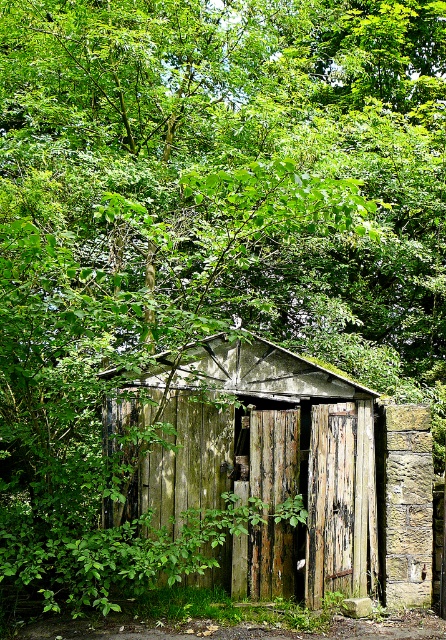
Image resolution: width=446 pixels, height=640 pixels. What do you see at coordinates (330, 500) in the screenshot? I see `peeling wood door at center` at bounding box center [330, 500].

Does peeling wood door at center appear on the right side of weathered wood door at center?

Correct, you'll find peeling wood door at center to the right of weathered wood door at center.

Who is more forward, (323, 428) or (250, 531)?

Positioned in front is point (250, 531).

I want to click on peeling wood door at center, so click(330, 500).

Can you confirm if weathered wood hut at center is smaller than peeling wood door at center?

No.

Measure the distance between point (359, 424) and camera.

Point (359, 424) and camera are 8.62 meters apart from each other.

Image resolution: width=446 pixels, height=640 pixels. In order to click on weathered wood hut at center in this screenshot , I will do `click(288, 468)`.

What do you see at coordinates (288, 468) in the screenshot?
I see `weathered wood hut at center` at bounding box center [288, 468].

What do you see at coordinates (288, 468) in the screenshot? I see `weathered wood hut at center` at bounding box center [288, 468].

Locate an element on the screen. Image resolution: width=446 pixels, height=640 pixels. weathered wood hut at center is located at coordinates [288, 468].